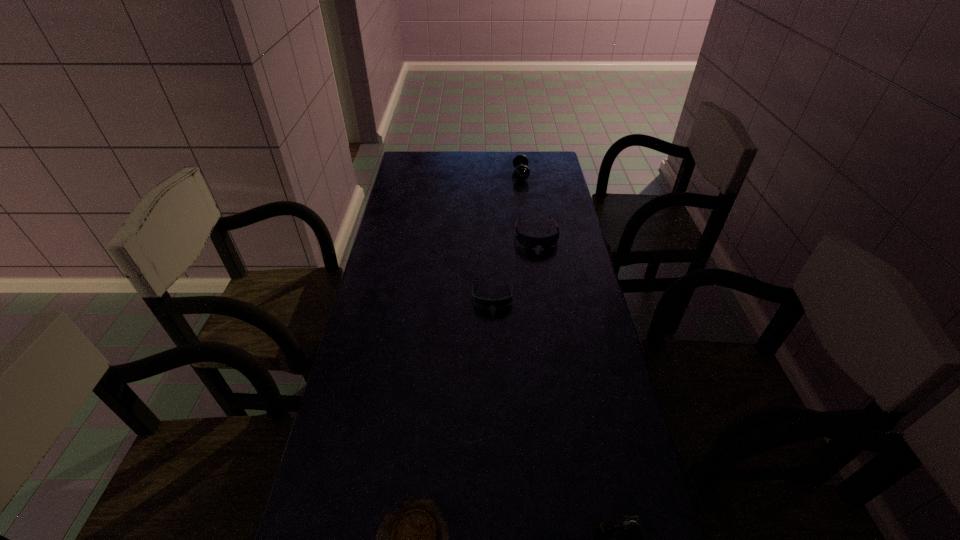
The image size is (960, 540). What are the coordinates of `object that can be found as the closest to the tallest goggles` in the screenshot? It's located at (484, 303).

Point out which goggles is positioned as the nearest to the leftmost goggles. Please provide its 2D coordinates. Your answer should be formatted as a tuple, i.e. [(x, y)], where the tuple contains the x and y coordinates of a point satisfying the conditions above.

[(530, 242)]

Select which goggles is the second closest to the nearest goggles. Please provide its 2D coordinates. Your answer should be formatted as a tuple, i.e. [(x, y)], where the tuple contains the x and y coordinates of a point satisfying the conditions above.

[(530, 242)]